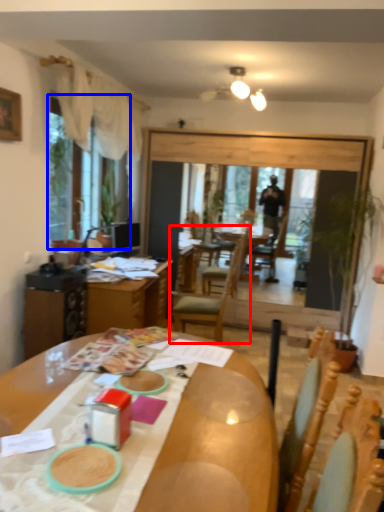
Question: Which point is further to the camera, chair (highlighted by a red box) or window screen (highlighted by a blue box)?

Choices:
 (A) chair
 (B) window screen

Answer: (A)